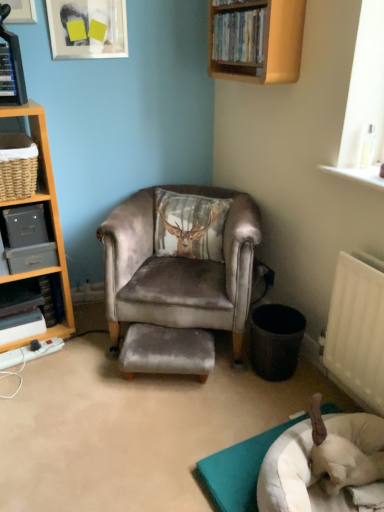
What are the coordinates of `free spot to the left of white fabric dog bed at lower right` in the screenshot? It's located at (164, 443).